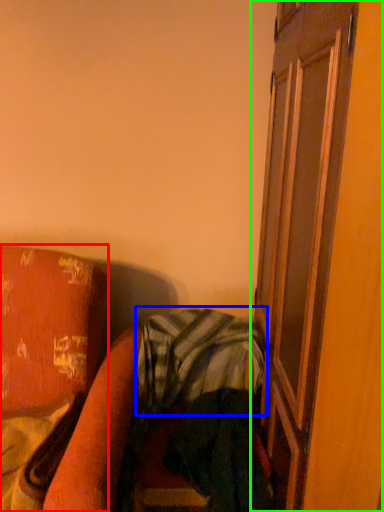
Question: Estimate the real-world distances between objects in this image. Which object is closer to furniture (highlighted by a red box), plaid (highlighted by a blue box) or screen door (highlighted by a green box)?

Choices:
 (A) plaid
 (B) screen door

Answer: (A)